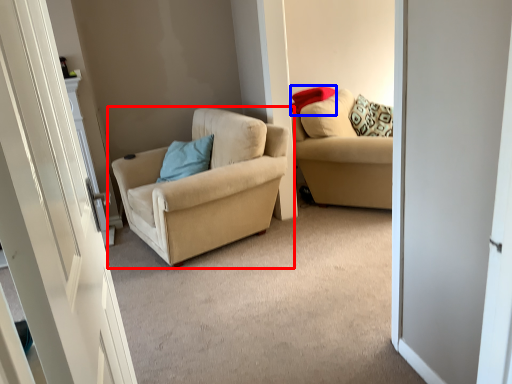
Question: Among these objects, which one is nearest to the camera, chair (highlighted by a red box) or pillow (highlighted by a blue box)?

Choices:
 (A) chair
 (B) pillow

Answer: (A)